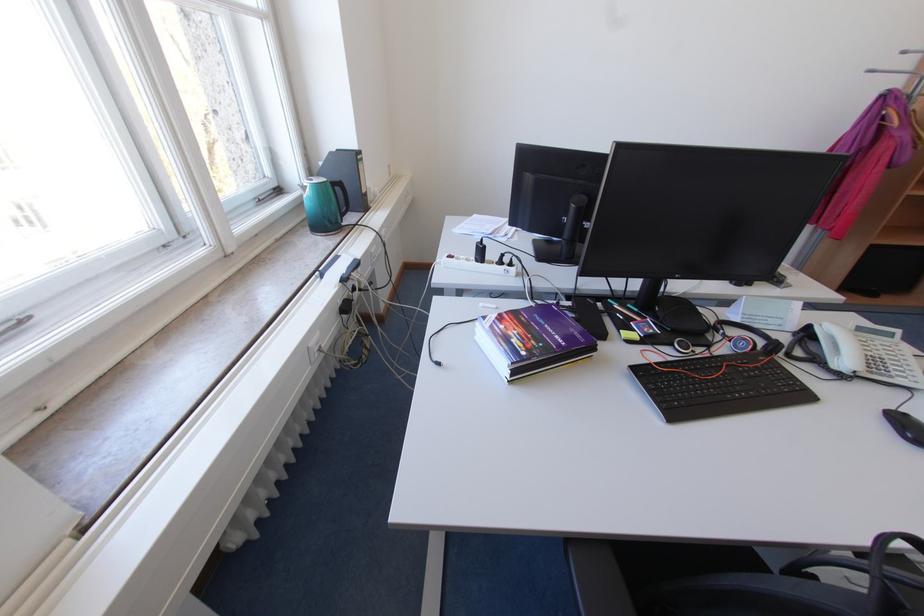
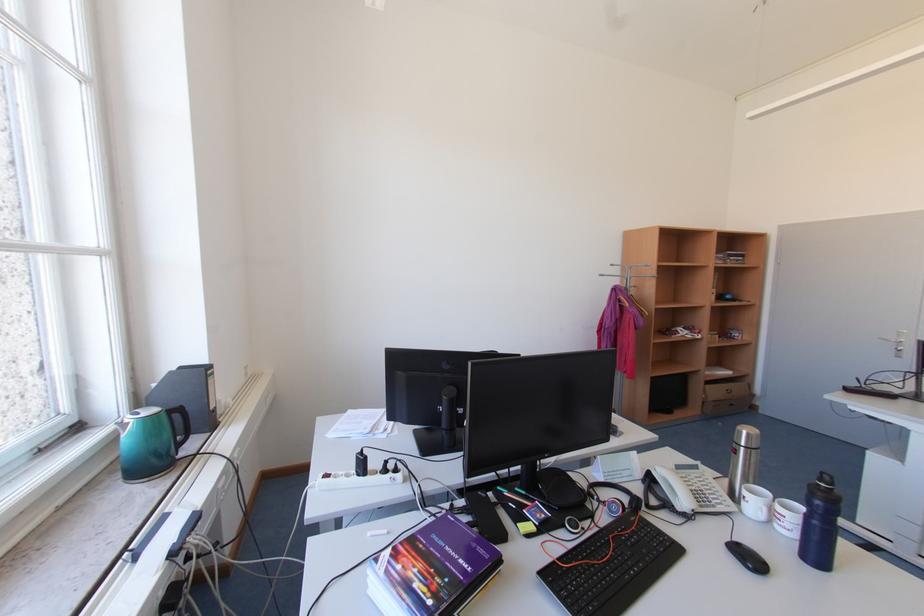
In the second image, find the point that corresponds to point (518, 339) in the first image.

(419, 583)